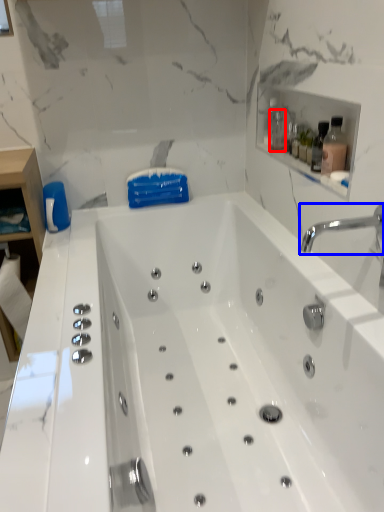
Question: Which of the following is the closest to the observer, bottle (highlighted by a red box) or tap (highlighted by a blue box)?

Choices:
 (A) bottle
 (B) tap

Answer: (B)